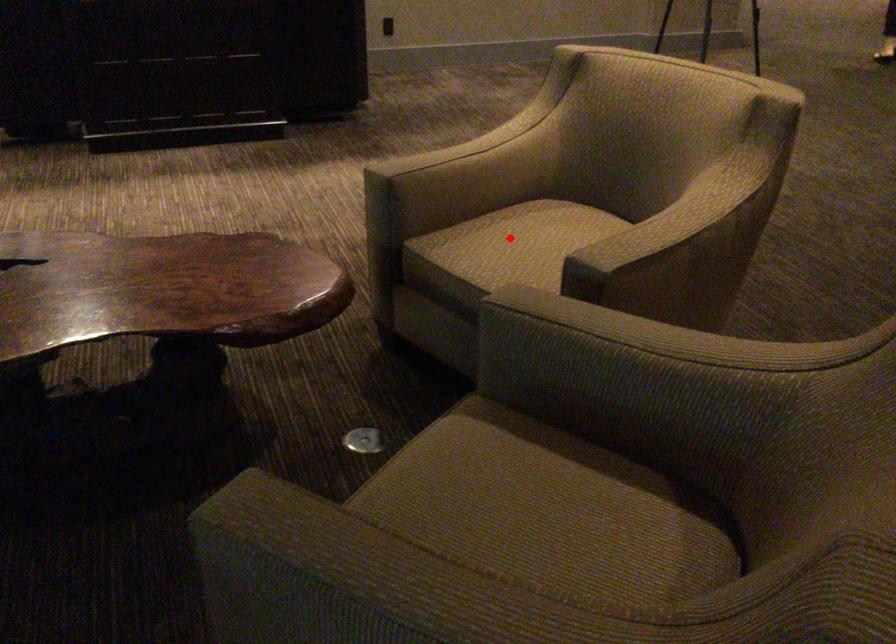
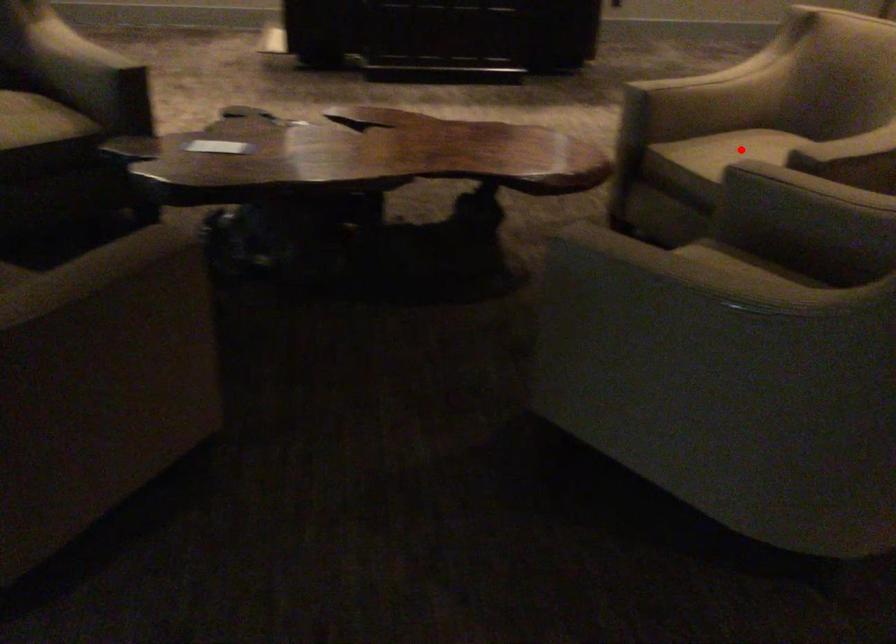
I am providing you with two images of the same scene from different viewpoints. A red point is marked on the first image and another point is marked on the second image. Is the red point in image1 aligned with the point shown in image2?

Yes